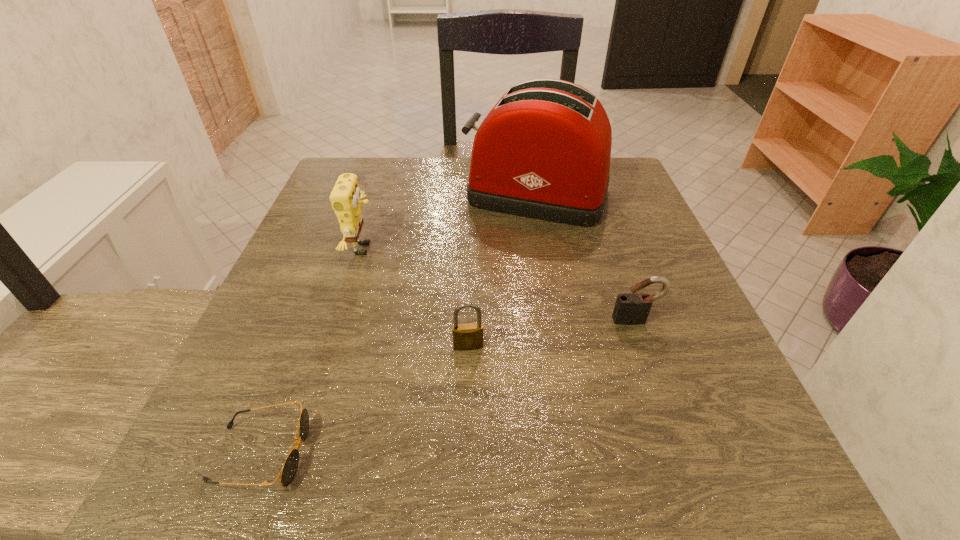
The height and width of the screenshot is (540, 960). I want to click on empty location between the sponge and the nearest object, so [x=312, y=351].

I want to click on vacant space that's between the left padlock and the nearest object, so click(x=365, y=400).

The width and height of the screenshot is (960, 540). Identify the location of vacant area that lies between the farther padlock and the left padlock. (552, 333).

Where is `free point between the tallest object and the sponge`? This screenshot has width=960, height=540. free point between the tallest object and the sponge is located at coordinates (450, 221).

Locate an element on the screen. The width and height of the screenshot is (960, 540). vacant space that is in between the tallest object and the nearest object is located at coordinates (398, 324).

I want to click on vacant area that lies between the fourth farthest object and the toaster, so click(502, 271).

Identify the location of vacant area that lies between the fourth shortest object and the tallest object. (450, 221).

Locate which object is the third closest to the second nearest object. Please provide its 2D coordinates. Your answer should be formatted as a tuple, i.e. [(x, y)], where the tuple contains the x and y coordinates of a point satisfying the conditions above.

[(633, 307)]

Select which object is the third closest to the nearest object. Please provide its 2D coordinates. Your answer should be formatted as a tuple, i.e. [(x, y)], where the tuple contains the x and y coordinates of a point satisfying the conditions above.

[(543, 152)]

The width and height of the screenshot is (960, 540). In order to click on free space in the image that satisfies the following two spatial constraints: 1. on the face of the fourth shortest object; 2. on the right side of the nearer padlock in this screenshot , I will do `click(333, 346)`.